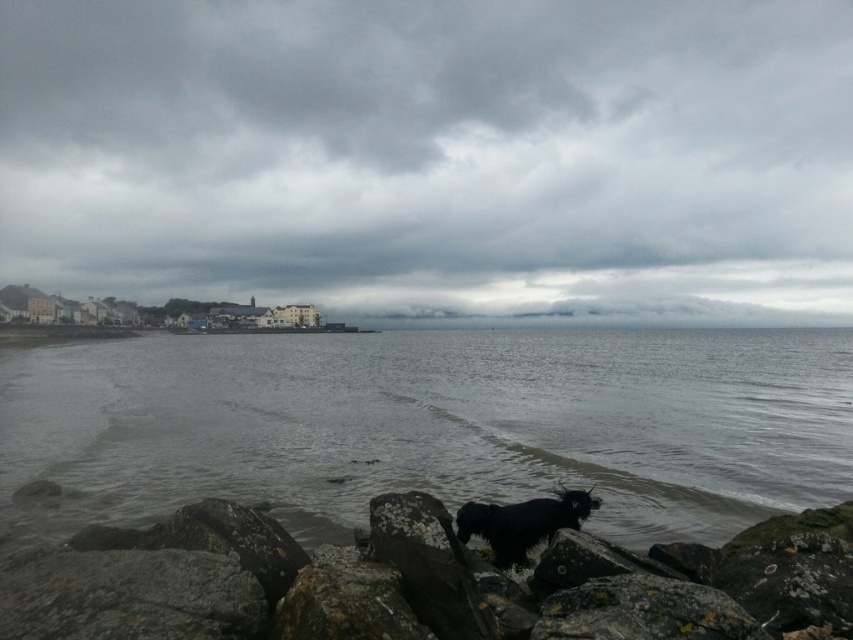
Question: Considering the real-world distances, which object is closest to the rough textured rock at lower center?

Choices:
 (A) gray matte water at center
 (B) shiny black fur at center

Answer: (B)

Question: Among these objects, which one is farthest from the camera?

Choices:
 (A) shiny black fur at center
 (B) rough textured rock at lower center
 (C) cloudy sky at upper center

Answer: (C)

Question: Which point is farther to the camera?

Choices:
 (A) (140, 230)
 (B) (527, 506)
 (C) (218, 513)
 (D) (720, 500)

Answer: (A)

Question: Can you confirm if gray matte water at center is positioned below shiny black fur at center?

Choices:
 (A) yes
 (B) no

Answer: (B)

Question: Can you confirm if gray matte water at center is thinner than shiny black fur at center?

Choices:
 (A) yes
 (B) no

Answer: (B)

Question: Is gray matte water at center to the left of rough textured rock at lower center from the viewer's perspective?

Choices:
 (A) no
 (B) yes

Answer: (A)